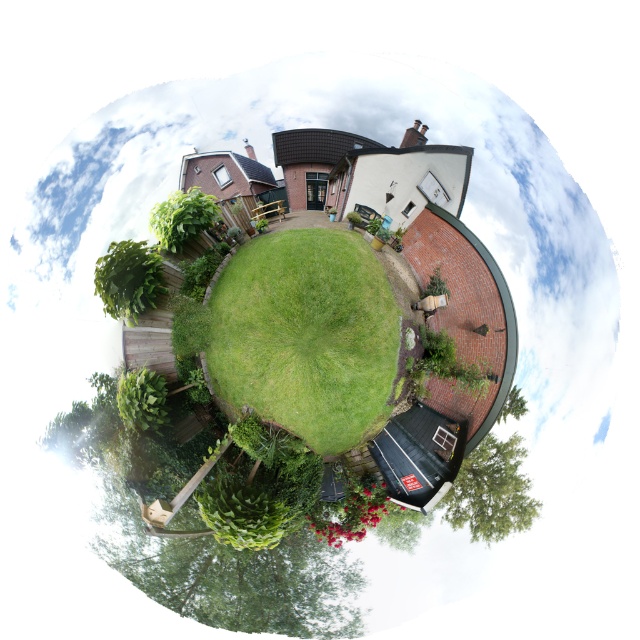
Which is more to the right, green grass at center or green leafy tree at lower left?

From the viewer's perspective, green grass at center appears more on the right side.

Find the location of a particular element. This screenshot has width=640, height=640. green grass at center is located at coordinates (307, 336).

Is point (211, 296) farther from camera compared to point (102, 273)?

That is True.

This screenshot has height=640, width=640. What are the coordinates of `green grass at center` in the screenshot? It's located at (307, 336).

Between green leafy tree at lower right and green leafy tree at lower left, which one has more height?

green leafy tree at lower right

Is green leafy tree at lower right in front of green leafy tree at lower left?

Yes, green leafy tree at lower right is closer to the viewer.

Is point (490, 452) in front of point (113, 300)?

Yes, point (490, 452) is in front of point (113, 300).

You are a GUI agent. You are given a task and a screenshot of the screen. Output one action in this format:
    pyautogui.click(x=<x>, y=<y>)
    Task: Click on the green leafy tree at lower right
    This screenshot has height=640, width=640.
    Given the screenshot: What is the action you would take?
    pyautogui.click(x=492, y=490)

Does green leafy tree at lower left have a greater height compared to green leafy tree at upper left?

Yes.

Does green leafy tree at lower left have a larger size compared to green leafy tree at upper left?

Correct, green leafy tree at lower left is larger in size than green leafy tree at upper left.

Which is behind, point (141, 250) or point (170, 209)?

The point (141, 250) is behind.

This screenshot has width=640, height=640. Find the location of `green leafy tree at lower left`. green leafy tree at lower left is located at coordinates (129, 278).